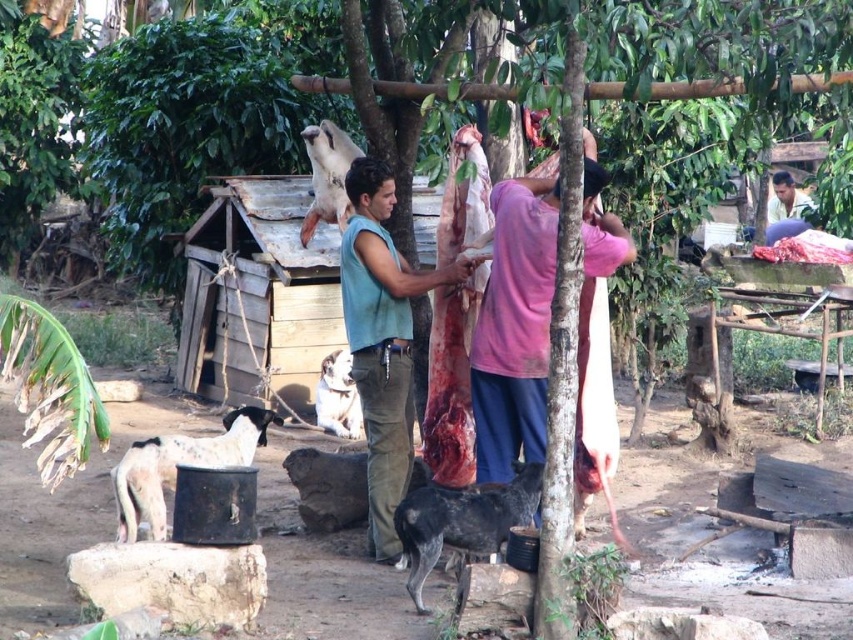
Which is below, white fur dog at upper center or white fur dog at center?

Positioned lower is white fur dog at center.

Is point (334, 150) in front of point (316, 401)?

That is True.

Identify the location of white fur dog at upper center. tap(328, 176).

You are a GUI agent. You are given a task and a screenshot of the screen. Output one action in this format:
    pyautogui.click(x=<x>, y=<y>)
    Task: Click on the white fur dog at upper center
    This screenshot has height=640, width=853.
    Given the screenshot: What is the action you would take?
    pyautogui.click(x=328, y=176)

Is white fur dog at lower left above white fur dog at center?

No.

Is point (160, 522) positioned behind point (341, 362)?

No, it is not.

The height and width of the screenshot is (640, 853). In order to click on white fur dog at lower left in this screenshot , I will do (180, 464).

Does pink cotton shirt at center have a greater height compared to teal sleeveless shirt at center?

Yes.

Is pink cotton shirt at center bigger than teal sleeveless shirt at center?

Yes.

Does point (506, 230) come farther from viewer compared to point (436, 269)?

No, (506, 230) is in front of (436, 269).

Find the location of a particular element. pink cotton shirt at center is located at coordinates (514, 317).